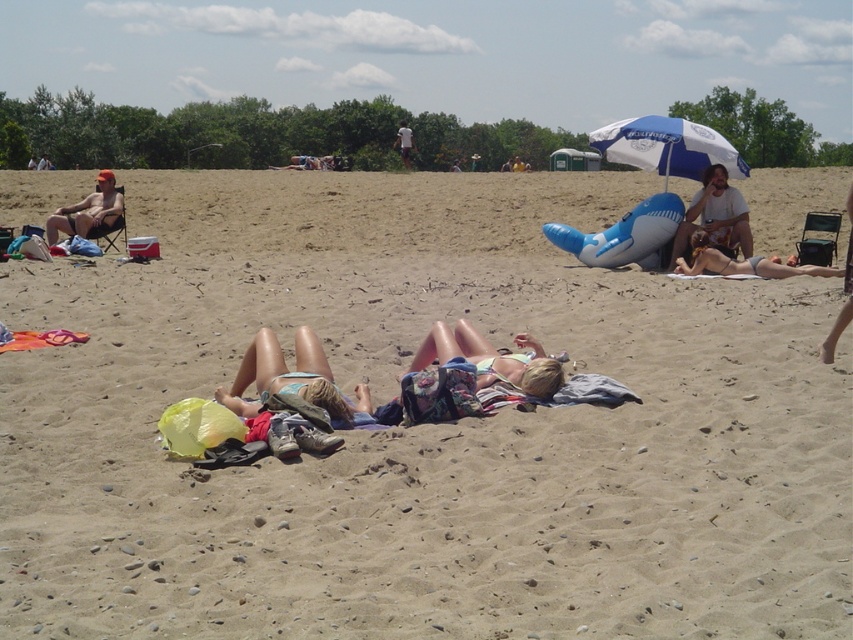
Does blue and white striped umbrella at upper right have a greater height compared to white cotton shirt at upper center?

Correct, blue and white striped umbrella at upper right is much taller as white cotton shirt at upper center.

Is blue and white striped umbrella at upper right smaller than white cotton shirt at upper center?

Actually, blue and white striped umbrella at upper right might be larger than white cotton shirt at upper center.

At what (x,y) coordinates should I click in order to perform the action: click on blue and white striped umbrella at upper right. Please return your answer as a coordinate pair (x, y). The width and height of the screenshot is (853, 640). Looking at the image, I should click on (666, 147).

The height and width of the screenshot is (640, 853). I want to click on tan bikini at center, so click(x=292, y=380).

Does tan bikini at center lie in front of blue and white striped umbrella at upper right?

That is True.

Does point (262, 371) come in front of point (683, 150)?

That is True.

Where is `tan bikini at center`? The image size is (853, 640). tan bikini at center is located at coordinates (292, 380).

Is beige fabric towel at upper right thinner than matte orange cap at left?

Incorrect, beige fabric towel at upper right's width is not less than matte orange cap at left's.

Can you confirm if beige fabric towel at upper right is smaller than matte orange cap at left?

No, beige fabric towel at upper right is not smaller than matte orange cap at left.

What do you see at coordinates (715, 216) in the screenshot?
I see `beige fabric towel at upper right` at bounding box center [715, 216].

Image resolution: width=853 pixels, height=640 pixels. I want to click on beige fabric towel at upper right, so click(x=715, y=216).